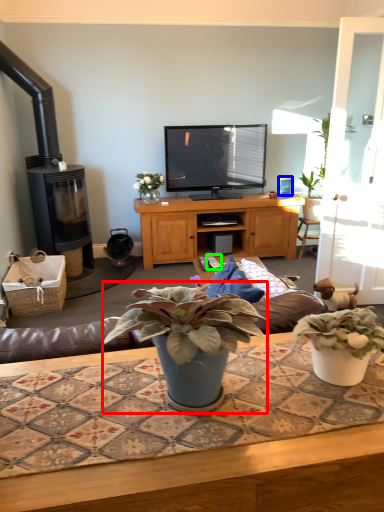
Question: Which is farther away from houseplant (highlighted by a red box)? coffee cup (highlighted by a blue box) or remote control (highlighted by a green box)?

Choices:
 (A) coffee cup
 (B) remote control

Answer: (A)